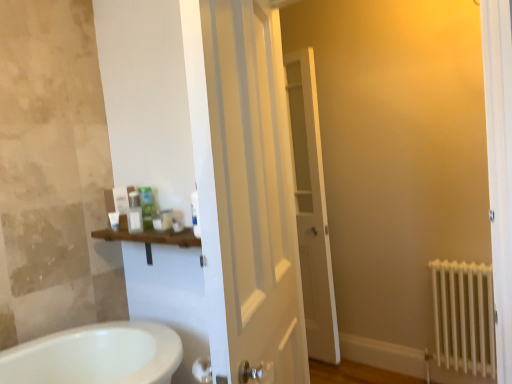
Where is `translucent plastic container at upper center, which is counted as the second toiletry, starting from the right`? translucent plastic container at upper center, which is counted as the second toiletry, starting from the right is located at coordinates (163, 220).

Describe the element at coordinates (177, 225) in the screenshot. This screenshot has height=384, width=512. I see `matte white container at center, which is the fifth toiletry in left-to-right order` at that location.

What do you see at coordinates (134, 212) in the screenshot?
I see `matte plastic container at center, the 2th toiletry when ordered from left to right` at bounding box center [134, 212].

The width and height of the screenshot is (512, 384). I want to click on matte white container at left, the 1th toiletry in the left-to-right sequence, so click(113, 220).

I want to click on white glossy door at center, the 2th door viewed from the back, so click(x=250, y=199).

Considering the relative positions of matte plastic container at center, the 4th toiletry when ordered from right to left, and matte white container at center, which is the fifth toiletry in left-to-right order, in the image provided, is matte plastic container at center, the 4th toiletry when ordered from right to left, to the left of matte white container at center, which is the fifth toiletry in left-to-right order, from the viewer's perspective?

Yes, matte plastic container at center, the 4th toiletry when ordered from right to left, is to the left of matte white container at center, which is the fifth toiletry in left-to-right order.

Can you see matte plastic container at center, the 2th toiletry when ordered from left to right, touching matte white container at center, which is the 1th toiletry in right-to-left order?

No, matte plastic container at center, the 2th toiletry when ordered from left to right, is not touching matte white container at center, which is the 1th toiletry in right-to-left order.

Is matte white container at center, which is the fifth toiletry in left-to-right order, at the back of matte plastic container at center, the 2th toiletry when ordered from left to right?

No, matte plastic container at center, the 2th toiletry when ordered from left to right,'s orientation is not away from matte white container at center, which is the fifth toiletry in left-to-right order.

Considering the points (130, 219) and (176, 224), which point is behind, point (130, 219) or point (176, 224)?

The point (130, 219) is farther from the camera.

Which is more to the right, white glossy door at center, the 1th door viewed from the front, or matte green bottle at upper left, marked as the 3th toiletry in a right-to-left arrangement?

Positioned to the right is white glossy door at center, the 1th door viewed from the front.

From the picture: Who is shorter, white glossy door at center, the 2th door viewed from the back, or matte green bottle at upper left, which appears as the third toiletry when viewed from the left?

With less height is matte green bottle at upper left, which appears as the third toiletry when viewed from the left.

Is white glossy door at center, the 2th door viewed from the back, positioned beyond the bounds of matte green bottle at upper left, which appears as the third toiletry when viewed from the left?

Yes, white glossy door at center, the 2th door viewed from the back, is located beyond the bounds of matte green bottle at upper left, which appears as the third toiletry when viewed from the left.

The width and height of the screenshot is (512, 384). In order to click on door above the white glossy door at center, marked as the second door in a front-to-back arrangement (from a real-world perspective) in this screenshot , I will do `click(250, 199)`.

In terms of height, does white glossy door at center, the 1th door viewed from the front, look taller or shorter compared to white glossy door at center, the first door viewed from the back?

In the image, white glossy door at center, the 1th door viewed from the front, appears to be shorter than white glossy door at center, the first door viewed from the back.

Is point (207, 99) closer to camera compared to point (291, 83)?

Yes, it is.

Which is more to the right, white glossy door at center, the 1th door viewed from the front, or white glossy door at center, marked as the second door in a front-to-back arrangement?

white glossy door at center, marked as the second door in a front-to-back arrangement, is more to the right.

Is point (168, 213) positioned behind point (178, 225)?

Yes, point (168, 213) is farther from viewer.

Which object is further away from the camera, translucent plastic container at upper center, which is the 4th toiletry from left to right, or matte white container at center, which is the fifth toiletry in left-to-right order?

translucent plastic container at upper center, which is the 4th toiletry from left to right, is more distant.

Is translucent plastic container at upper center, which is counted as the second toiletry, starting from the right, positioned with its back to matte white container at center, which is the fifth toiletry in left-to-right order?

That's not correct — translucent plastic container at upper center, which is counted as the second toiletry, starting from the right, is not looking away from matte white container at center, which is the fifth toiletry in left-to-right order.

In the scene shown: Is translucent plastic container at upper center, which is the 4th toiletry from left to right, taller than matte white container at center, which is the 1th toiletry in right-to-left order?

Yes.

Which is further, (x=206, y=240) or (x=182, y=223)?

The point (x=182, y=223) is farther.

Can you tell me how much white glossy door at center, the 2th door viewed from the back, and matte white container at center, which is the 1th toiletry in right-to-left order, differ in facing direction?

They differ by 111 degrees in their facing directions.

From a real-world perspective, which is physically below, white glossy door at center, the 2th door viewed from the back, or matte white container at center, which is the 1th toiletry in right-to-left order?

matte white container at center, which is the 1th toiletry in right-to-left order.

Are white glossy door at center, the 2th door viewed from the back, and matte white container at center, which is the fifth toiletry in left-to-right order, far apart?

No, white glossy door at center, the 2th door viewed from the back, is not far away from matte white container at center, which is the fifth toiletry in left-to-right order.

Based on the photo, from a real-world perspective, who is located higher, matte white container at left, the 1th toiletry in the left-to-right sequence, or translucent plastic container at upper center, which is the 4th toiletry from left to right?

In real-world perspective, matte white container at left, the 1th toiletry in the left-to-right sequence, is above.

Is translucent plastic container at upper center, which is counted as the second toiletry, starting from the right, a part of matte white container at left, the 1th toiletry in the left-to-right sequence?

No, translucent plastic container at upper center, which is counted as the second toiletry, starting from the right, is not a part of matte white container at left, the 1th toiletry in the left-to-right sequence.

Would you consider matte white container at left, the 1th toiletry in the left-to-right sequence, to be distant from translucent plastic container at upper center, which is the 4th toiletry from left to right?

No, matte white container at left, the 1th toiletry in the left-to-right sequence, is not far away from translucent plastic container at upper center, which is the 4th toiletry from left to right.

Is matte white container at left, the 1th toiletry in the left-to-right sequence, shorter than translucent plastic container at upper center, which is counted as the second toiletry, starting from the right?

A: Indeed, matte white container at left, the 1th toiletry in the left-to-right sequence, has a lesser height compared to translucent plastic container at upper center, which is counted as the second toiletry, starting from the right.

From a real-world perspective, is translucent plastic container at upper center, which is counted as the second toiletry, starting from the right, on white matte radiator at lower right?

Yes, from a real-world perspective, translucent plastic container at upper center, which is counted as the second toiletry, starting from the right, is on top of white matte radiator at lower right.

This screenshot has width=512, height=384. I want to click on radiator behind the translucent plastic container at upper center, which is counted as the second toiletry, starting from the right, so click(464, 316).

Does translucent plastic container at upper center, which is the 4th toiletry from left to right, appear on the right side of white matte radiator at lower right?

No.

Is point (169, 222) closer to viewer compared to point (438, 360)?

That is True.

From the matte white container at center, which is the fifth toiletry in left-to-right order, count the 3rd toiletry to the left and point to it. Please provide its 2D coordinates.

[(134, 212)]

Image resolution: width=512 pixels, height=384 pixels. What are the coordinates of `the 1st door to the right of the matte green bottle at upper left, marked as the 3th toiletry in a right-to-left arrangement, starting your count from the anchor` in the screenshot? It's located at point(250,199).

Looking at the image, which one is located further to matte white container at center, which is the fifth toiletry in left-to-right order, matte white container at left, placed as the fifth toiletry when sorted from right to left, or white glossy door at center, the 1th door viewed from the front?

white glossy door at center, the 1th door viewed from the front, lies further to matte white container at center, which is the fifth toiletry in left-to-right order, than the other object.

Which object lies nearer to the anchor point matte white container at left, the 1th toiletry in the left-to-right sequence, matte green bottle at upper left, which appears as the third toiletry when viewed from the left, or matte plastic container at center, the 2th toiletry when ordered from left to right?

matte plastic container at center, the 2th toiletry when ordered from left to right.

Consider the image. Which object lies further to the anchor point matte white container at center, which is the 1th toiletry in right-to-left order, white glossy door at center, the 2th door viewed from the back, or white glossy door at center, marked as the second door in a front-to-back arrangement?

white glossy door at center, marked as the second door in a front-to-back arrangement, is positioned further to the anchor matte white container at center, which is the 1th toiletry in right-to-left order.

Estimate the real-world distances between objects in this image. Which object is closer to matte green bottle at upper left, marked as the 3th toiletry in a right-to-left arrangement, white glossy door at center, the 2th door viewed from the back, or matte white container at center, which is the fifth toiletry in left-to-right order?

matte white container at center, which is the fifth toiletry in left-to-right order, lies closer to matte green bottle at upper left, marked as the 3th toiletry in a right-to-left arrangement, than the other object.

Estimate the real-world distances between objects in this image. Which object is further from white matte radiator at lower right, matte white container at center, which is the fifth toiletry in left-to-right order, or translucent plastic container at upper center, which is the 4th toiletry from left to right?

Based on the image, translucent plastic container at upper center, which is the 4th toiletry from left to right, appears to be further to white matte radiator at lower right.

Based on their spatial positions, is white glossy door at center, the 2th door viewed from the back, or matte white container at left, the 1th toiletry in the left-to-right sequence, further from matte green bottle at upper left, which appears as the third toiletry when viewed from the left?

white glossy door at center, the 2th door viewed from the back.

From the image, which object appears to be nearer to white glossy door at center, the first door viewed from the back, translucent plastic container at upper center, which is the 4th toiletry from left to right, or matte white container at center, which is the fifth toiletry in left-to-right order?

The object closer to white glossy door at center, the first door viewed from the back, is translucent plastic container at upper center, which is the 4th toiletry from left to right.

Estimate the real-world distances between objects in this image. Which object is closer to matte green bottle at upper left, marked as the 3th toiletry in a right-to-left arrangement, matte white container at left, the 1th toiletry in the left-to-right sequence, or white matte radiator at lower right?

The object closer to matte green bottle at upper left, marked as the 3th toiletry in a right-to-left arrangement, is matte white container at left, the 1th toiletry in the left-to-right sequence.

Locate an element on the screen. The height and width of the screenshot is (384, 512). toiletry between white glossy door at center, the 2th door viewed from the back, and translucent plastic container at upper center, which is the 4th toiletry from left to right, along the z-axis is located at coordinates (177, 225).

This screenshot has height=384, width=512. I want to click on toiletry located between translucent plastic container at upper center, which is counted as the second toiletry, starting from the right, and white glossy door at center, the first door viewed from the back, in the left-right direction, so click(x=177, y=225).

At what (x,y) coordinates should I click in order to perform the action: click on toiletry between translucent plastic container at upper center, which is counted as the second toiletry, starting from the right, and white matte radiator at lower right, in the horizontal direction. Please return your answer as a coordinate pair (x, y). This screenshot has width=512, height=384. Looking at the image, I should click on (177, 225).

Where is `radiator between white glossy door at center, the 2th door viewed from the back, and white glossy door at center, marked as the second door in a front-to-back arrangement, in the front-back direction`? radiator between white glossy door at center, the 2th door viewed from the back, and white glossy door at center, marked as the second door in a front-to-back arrangement, in the front-back direction is located at coordinates (464, 316).